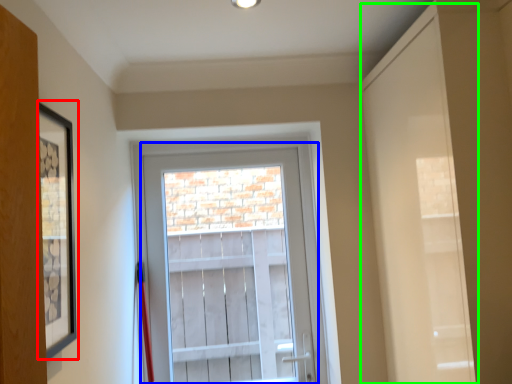
Question: Based on their relative distances, which object is farther from picture frame (highlighted by a red box)? Choose from glass door (highlighted by a blue box) and door (highlighted by a green box).

Choices:
 (A) glass door
 (B) door

Answer: (A)